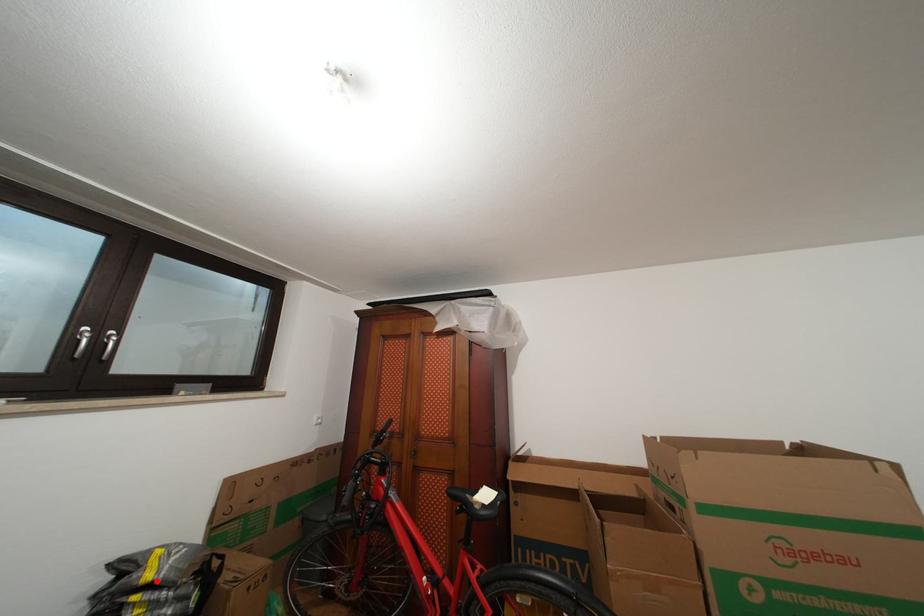
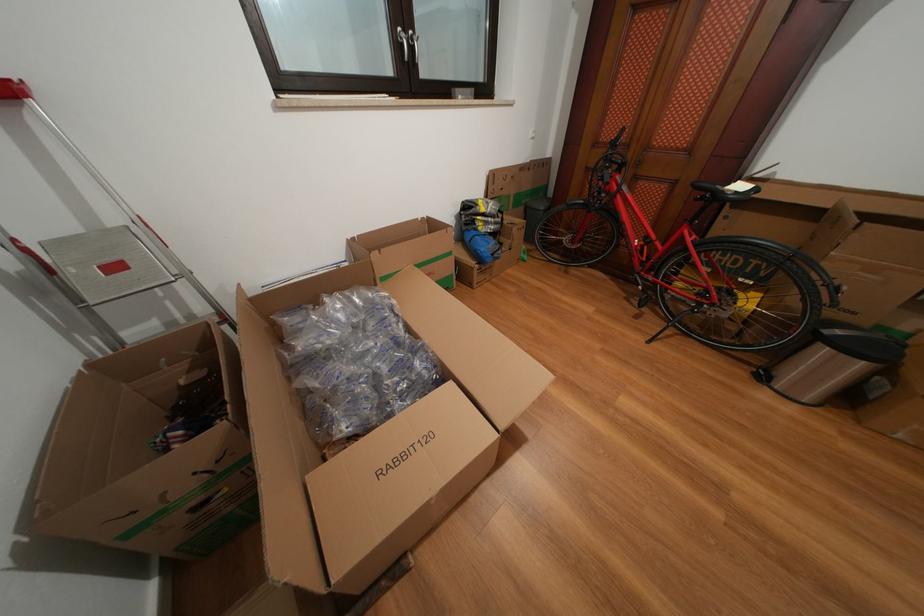
In the second image, find the point that corresponds to the highlighted location in the first image.

(491, 215)